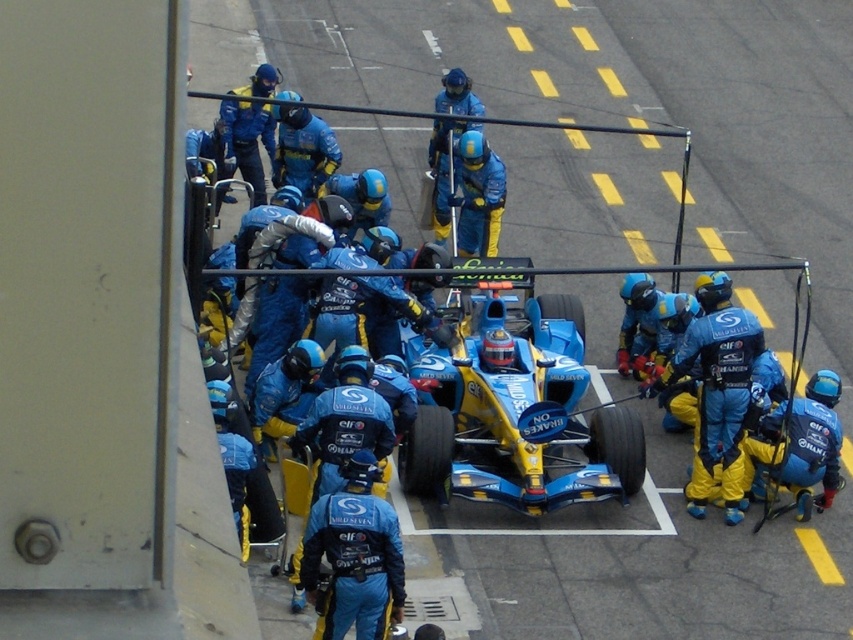
Question: Based on their relative distances, which object is farther from the blue fabric suit at center?

Choices:
 (A) blue glossy race car at center
 (B) blue/textured jumpsuit at lower right

Answer: (B)

Question: Which object is the closest to the blue/textured jumpsuit at lower right?

Choices:
 (A) blue fabric suit at center
 (B) blue glossy race car at center

Answer: (B)

Question: In this image, where is blue fabric suit at center located relative to blue/textured jumpsuit at lower right?

Choices:
 (A) right
 (B) left

Answer: (B)

Question: Which point is closer to the camera taking this photo?

Choices:
 (A) (544, 301)
 (B) (750, 349)
 (C) (357, 637)

Answer: (C)

Question: Where is blue glossy race car at center located in relation to blue/textured jumpsuit at lower right in the image?

Choices:
 (A) left
 (B) right

Answer: (A)

Question: Can you confirm if blue glossy race car at center is positioned above blue fabric suit at center?

Choices:
 (A) no
 (B) yes

Answer: (B)